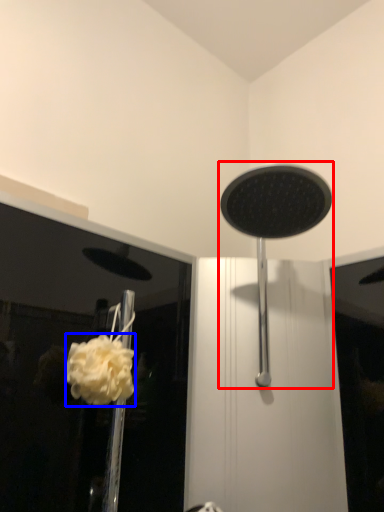
Question: Which point is closer to the camera, shower (highlighted by a red box) or flower (highlighted by a blue box)?

Choices:
 (A) shower
 (B) flower

Answer: (A)